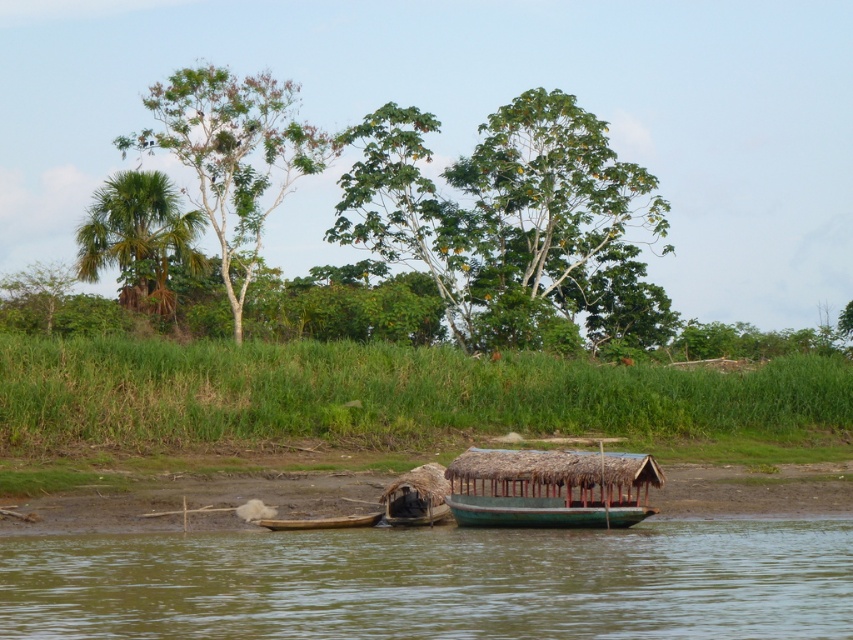
You are standing at the riverside and want to take a photo of the green grass at lower center and the green leafy tree at upper center. Which object will appear closer to the bottom of your camera viewfinder?

The green grass at lower center will appear closer to the bottom of the camera viewfinder because it is positioned below the green leafy tree at upper center.

You are standing on the riverside and want to take a photo of the wooden boat at center and the green leafy tree at center. Which object should you frame first in your camera viewfinder to ensure both are in the shot?

You should frame the green leafy tree at center first because it is to the left of the wooden boat at center, so positioning the tree first ensures the boat will also be included in the viewfinder.